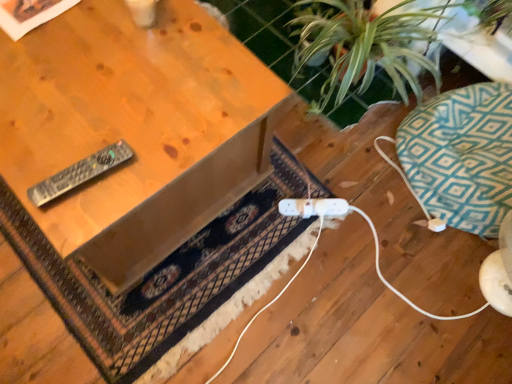
Question: From the image's perspective, is teal geometric cushion at right above black plastic remote at left?

Choices:
 (A) no
 (B) yes

Answer: (B)

Question: Considering the relative sizes of teal geometric cushion at right and black plastic remote at left in the image provided, is teal geometric cushion at right thinner than black plastic remote at left?

Choices:
 (A) no
 (B) yes

Answer: (A)

Question: Could you tell me if teal geometric cushion at right is facing black plastic remote at left?

Choices:
 (A) no
 (B) yes

Answer: (A)

Question: Is teal geometric cushion at right facing away from black plastic remote at left?

Choices:
 (A) no
 (B) yes

Answer: (A)

Question: Is teal geometric cushion at right behind black plastic remote at left?

Choices:
 (A) no
 (B) yes

Answer: (B)

Question: From a real-world perspective, is teal geometric cushion at right above or below wooden table at upper left?

Choices:
 (A) above
 (B) below

Answer: (B)

Question: From the image's perspective, is teal geometric cushion at right positioned above or below wooden table at upper left?

Choices:
 (A) above
 (B) below

Answer: (B)

Question: In terms of height, does teal geometric cushion at right look taller or shorter compared to wooden table at upper left?

Choices:
 (A) tall
 (B) short

Answer: (B)

Question: Which is correct: teal geometric cushion at right is inside wooden table at upper left, or outside of it?

Choices:
 (A) inside
 (B) outside

Answer: (B)

Question: In terms of size, does green leafy plant at upper right appear bigger or smaller than dark brown woven rug at center?

Choices:
 (A) big
 (B) small

Answer: (A)

Question: Is point pos(448,3) positioned closer to the camera than point pos(249,251)?

Choices:
 (A) farther
 (B) closer

Answer: (A)

Question: In terms of width, does green leafy plant at upper right look wider or thinner when compared to dark brown woven rug at center?

Choices:
 (A) wide
 (B) thin

Answer: (B)

Question: From the image's perspective, relative to dark brown woven rug at center, is green leafy plant at upper right above or below?

Choices:
 (A) below
 (B) above

Answer: (B)

Question: Which is correct: dark brown woven rug at center is inside teal geometric cushion at right, or outside of it?

Choices:
 (A) outside
 (B) inside

Answer: (A)

Question: Is dark brown woven rug at center taller or shorter than teal geometric cushion at right?

Choices:
 (A) tall
 (B) short

Answer: (B)